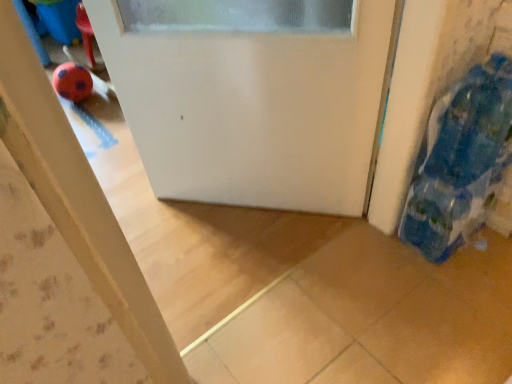
Question: Should I look upward or downward to see blue fabric bag at right?

Choices:
 (A) up
 (B) down

Answer: (A)

Question: From the image's perspective, is blue fabric bag at right under white matte door at center?

Choices:
 (A) yes
 (B) no

Answer: (A)

Question: Can you confirm if blue fabric bag at right is thinner than white matte door at center?

Choices:
 (A) no
 (B) yes

Answer: (A)

Question: Is the position of blue fabric bag at right more distant than that of white matte door at center?

Choices:
 (A) no
 (B) yes

Answer: (A)

Question: Can you confirm if blue fabric bag at right is shorter than white matte door at center?

Choices:
 (A) yes
 (B) no

Answer: (A)

Question: From a real-world perspective, is blue fabric bag at right over white matte door at center?

Choices:
 (A) yes
 (B) no

Answer: (A)

Question: Does blue fabric bag at right appear on the right side of white matte door at center?

Choices:
 (A) no
 (B) yes

Answer: (B)

Question: Considering the relative sizes of white matte door at center and blue fabric bag at right in the image provided, is white matte door at center smaller than blue fabric bag at right?

Choices:
 (A) yes
 (B) no

Answer: (B)

Question: Can you confirm if white matte door at center is shorter than blue fabric bag at right?

Choices:
 (A) no
 (B) yes

Answer: (A)

Question: From the image's perspective, would you say white matte door at center is shown under blue fabric bag at right?

Choices:
 (A) yes
 (B) no

Answer: (B)

Question: Is white matte door at center turned away from blue fabric bag at right?

Choices:
 (A) no
 (B) yes

Answer: (A)

Question: Could you tell me if white matte door at center is turned towards blue fabric bag at right?

Choices:
 (A) no
 (B) yes

Answer: (A)

Question: From a real-world perspective, is white matte door at center beneath blue fabric bag at right?

Choices:
 (A) no
 (B) yes

Answer: (B)

Question: Is point (346, 82) positioned closer to the camera than point (423, 213)?

Choices:
 (A) farther
 (B) closer

Answer: (B)